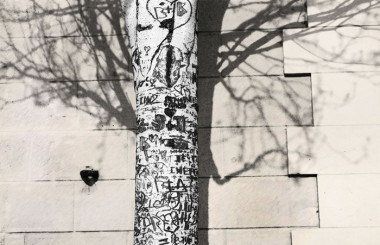
At what (x,y) coordinates should I click in order to perform the action: click on plant. Please return your answer as a coordinate pair (x, y). Looking at the image, I should click on (174, 136).